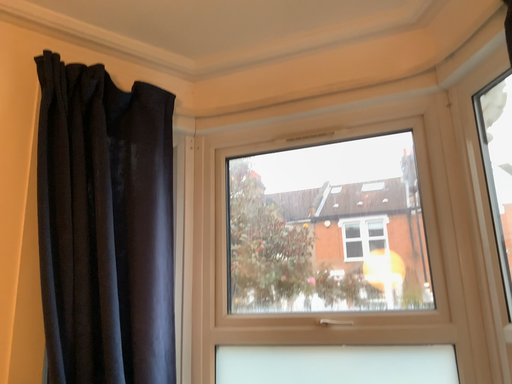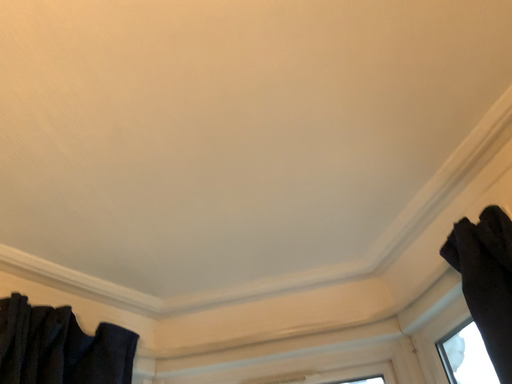
Question: Which way did the camera rotate in the video?

Choices:
 (A) rotated right
 (B) rotated left

Answer: (A)